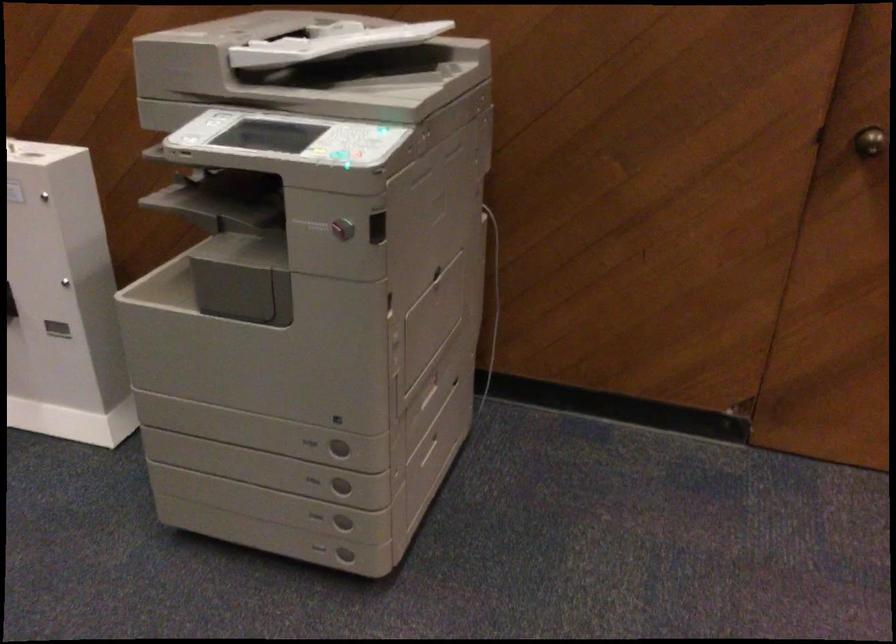
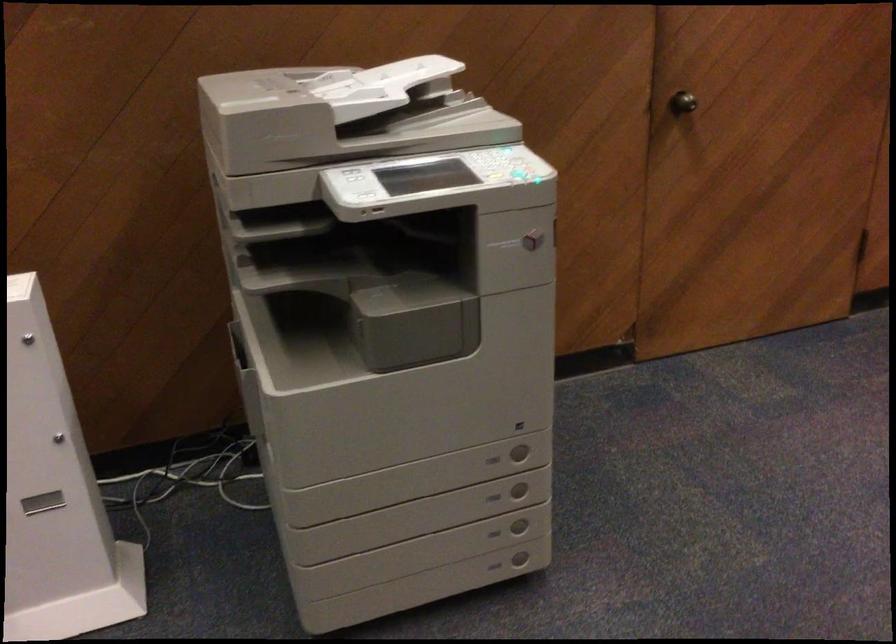
In the second image, find the point that corresponds to point (349, 165) in the first image.

(521, 176)